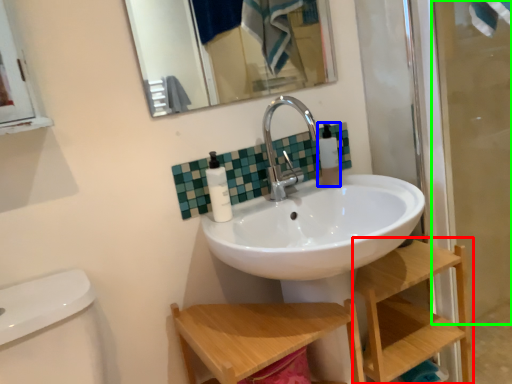
Question: Based on their relative distances, which object is nearer to shelf (highlighted by a red box)? Choose from toiletry (highlighted by a blue box) and screen door (highlighted by a green box).

Choices:
 (A) toiletry
 (B) screen door

Answer: (A)